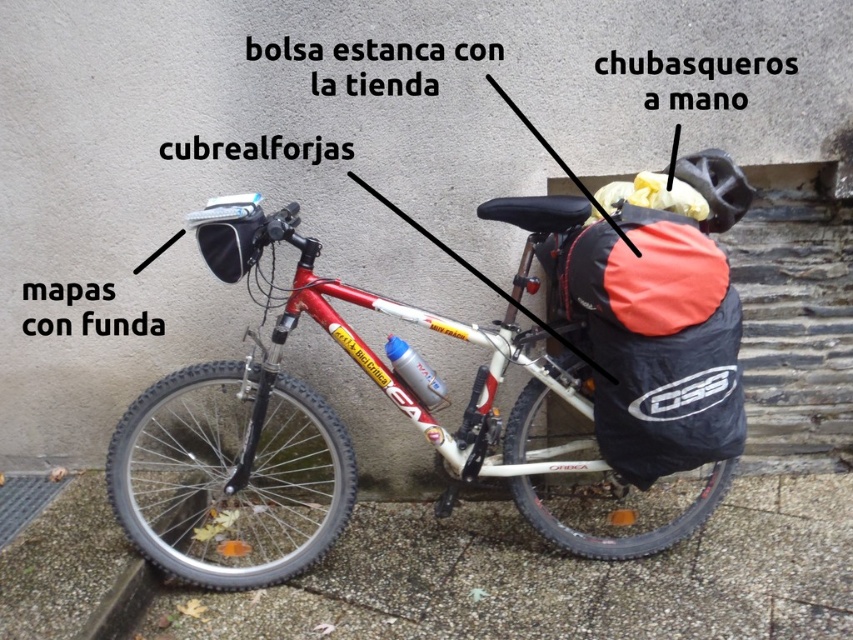
Is point (488, 364) closer to viewer compared to point (720, 163)?

No, it is not.

Does point (167, 522) come closer to viewer compared to point (734, 172)?

No, it is not.

Image resolution: width=853 pixels, height=640 pixels. Find the location of `shiny metallic bicycle at center`. shiny metallic bicycle at center is located at coordinates (344, 433).

At what (x,y) coordinates should I click in order to perform the action: click on black/orange fabric bag at center-right. Please return your answer as a coordinate pair (x, y). This screenshot has width=853, height=640. Looking at the image, I should click on (657, 340).

What do you see at coordinates (657, 340) in the screenshot? I see `black/orange fabric bag at center-right` at bounding box center [657, 340].

Is point (670, 410) positioned after point (752, 196)?

That is False.

Locate an element on the screen. This screenshot has width=853, height=640. black/orange fabric bag at center-right is located at coordinates (657, 340).

Does shiny metallic bicycle at center appear over black/orange fabric bag at center-right?

No, shiny metallic bicycle at center is not above black/orange fabric bag at center-right.

Does shiny metallic bicycle at center have a smaller size compared to black/orange fabric bag at center-right?

No.

The height and width of the screenshot is (640, 853). What do you see at coordinates (344, 433) in the screenshot?
I see `shiny metallic bicycle at center` at bounding box center [344, 433].

This screenshot has width=853, height=640. I want to click on shiny metallic bicycle at center, so click(344, 433).